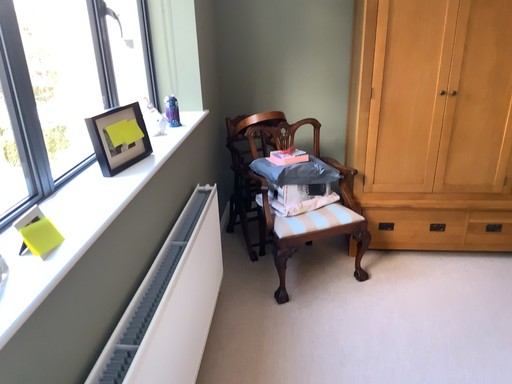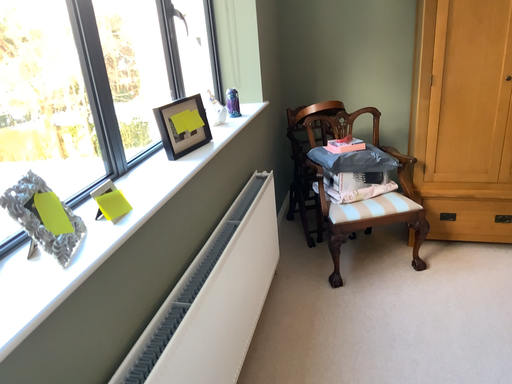
Question: How did the camera likely rotate when shooting the video?

Choices:
 (A) rotated right
 (B) rotated left

Answer: (B)